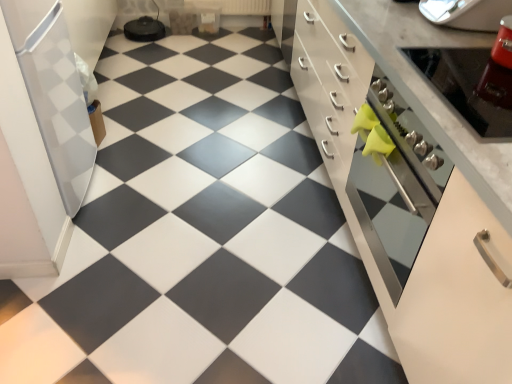
What do you see at coordinates (470, 86) in the screenshot? I see `metallic silver oven at right, the 2th appliance viewed from the right` at bounding box center [470, 86].

Where is `white glossy refrigerator at left, marked as the 1th appliance in a left-to-right arrangement`? The height and width of the screenshot is (384, 512). white glossy refrigerator at left, marked as the 1th appliance in a left-to-right arrangement is located at coordinates point(54,93).

Measure the distance between white glossy cabinet at center and camera.

The depth of white glossy cabinet at center is 32.90 inches.

Locate an element on the screen. matte black tile at center is located at coordinates (201, 237).

How much space does metallic silver toaster at upper right, which appears as the third appliance when viewed from the left, occupy horizontally?

metallic silver toaster at upper right, which appears as the third appliance when viewed from the left, is 33.33 centimeters in width.

Where is `metallic silver oven at right, the 2th appliance viewed from the right`? This screenshot has width=512, height=384. metallic silver oven at right, the 2th appliance viewed from the right is located at coordinates (470, 86).

In terms of height, does matte black tile at center look taller or shorter compared to white glossy cabinet at center?

Considering their sizes, matte black tile at center has less height than white glossy cabinet at center.

From the image's perspective, is matte black tile at center located beneath white glossy cabinet at center?

No, from the image's perspective, matte black tile at center is not beneath white glossy cabinet at center.

Find the location of a particular element. This screenshot has width=512, height=384. cabinetry located above the matte black tile at center (from a real-world perspective) is located at coordinates (414, 182).

Based on the photo, which of these two, white glossy cabinet at center or metallic silver toaster at upper right, the 1th appliance viewed from the right, is bigger?

white glossy cabinet at center is bigger.

Measure the distance between white glossy cabinet at center and metallic silver toaster at upper right, which appears as the third appliance when viewed from the left.

white glossy cabinet at center is 18.57 inches from metallic silver toaster at upper right, which appears as the third appliance when viewed from the left.

Does point (403, 91) come closer to viewer compared to point (450, 20)?

Yes, point (403, 91) is in front of point (450, 20).

From the image's perspective, is white glossy cabinet at center on top of metallic silver toaster at upper right, the 1th appliance viewed from the right?

No.

Is metallic silver oven at right, which is counted as the 2th appliance, starting from the left, positioned behind white glossy cabinet at center?

Yes, it is.

This screenshot has height=384, width=512. In order to click on appliance that is the 1st object to the right of the white glossy cabinet at center, starting at the anchor in this screenshot , I will do `click(470, 86)`.

Is metallic silver oven at right, which is counted as the 2th appliance, starting from the left, oriented towards white glossy cabinet at center?

Yes, metallic silver oven at right, which is counted as the 2th appliance, starting from the left, is aimed at white glossy cabinet at center.

Is metallic silver oven at right, the 2th appliance viewed from the right, smaller than white glossy cabinet at center?

Yes.

How many degrees apart are the facing directions of metallic silver oven at right and metallic silver toaster at upper right, the 1th appliance viewed from the right?

The facing directions of metallic silver oven at right and metallic silver toaster at upper right, the 1th appliance viewed from the right, are 0.000274 degrees apart.

Considering the relative sizes of metallic silver oven at right and metallic silver toaster at upper right, the 1th appliance viewed from the right, in the image provided, is metallic silver oven at right smaller than metallic silver toaster at upper right, the 1th appliance viewed from the right,?

Incorrect, metallic silver oven at right is not smaller in size than metallic silver toaster at upper right, the 1th appliance viewed from the right.

Which is behind, metallic silver oven at right or metallic silver toaster at upper right, the 1th appliance viewed from the right?

metallic silver toaster at upper right, the 1th appliance viewed from the right, is further away from the camera.

Is metallic silver oven at right turned away from metallic silver toaster at upper right, the 1th appliance viewed from the right?

metallic silver oven at right does not have its back to metallic silver toaster at upper right, the 1th appliance viewed from the right.

From a real-world perspective, relative to metallic silver oven at right, is matte black tile at center vertically above or below?

In terms of real-world spatial position, matte black tile at center is below metallic silver oven at right.

Between matte black tile at center and metallic silver oven at right, which one has less height?

matte black tile at center is shorter.

Is matte black tile at center looking in the opposite direction of metallic silver oven at right?

That's not correct — matte black tile at center is not looking away from metallic silver oven at right.

Is matte black tile at center completely or partially outside of metallic silver oven at right?

Yes, matte black tile at center is outside of metallic silver oven at right.

Is white glossy cabinet at center to the right of matte black tile at center from the viewer's perspective?

Yes, white glossy cabinet at center is to the right of matte black tile at center.

From a real-world perspective, which is physically below, white glossy cabinet at center or matte black tile at center?

matte black tile at center.

Is white glossy cabinet at center outside of matte black tile at center?

Absolutely, white glossy cabinet at center is external to matte black tile at center.

From the image's perspective, between white glossy cabinet at center and matte black tile at center, which one is located above?

matte black tile at center is shown above in the image.

Is metallic silver oven at right, which is counted as the 2th appliance, starting from the left, to the left or to the right of metallic silver oven at right in the image?

In the image, metallic silver oven at right, which is counted as the 2th appliance, starting from the left, appears on the left side of metallic silver oven at right.

Does point (476, 73) lie behind point (361, 196)?

No, (476, 73) is in front of (361, 196).

From the image's perspective, which one is positioned higher, metallic silver oven at right, which is counted as the 2th appliance, starting from the left, or metallic silver oven at right?

From the image's view, metallic silver oven at right, which is counted as the 2th appliance, starting from the left, is above.

Considering the sizes of metallic silver oven at right, which is counted as the 2th appliance, starting from the left, and metallic silver oven at right in the image, is metallic silver oven at right, which is counted as the 2th appliance, starting from the left, bigger or smaller than metallic silver oven at right?

metallic silver oven at right, which is counted as the 2th appliance, starting from the left, is smaller than metallic silver oven at right.

You are a GUI agent. You are given a task and a screenshot of the screen. Output one action in this format:
    pyautogui.click(x=<x>, y=<y>)
    Task: Click on the tile that appears below the white glossy cabinet at center (from a real-world perspective)
    The image size is (512, 384).
    Given the screenshot: What is the action you would take?
    pyautogui.click(x=201, y=237)

Locate an element on the screen. This screenshot has width=512, height=384. the 3rd appliance positioned above the white glossy cabinet at center (from the image's perspective) is located at coordinates (466, 13).

From the image, which object appears to be farther from metallic silver oven at right, metallic silver oven at right, the 2th appliance viewed from the right, or metallic silver toaster at upper right, the 1th appliance viewed from the right?

metallic silver toaster at upper right, the 1th appliance viewed from the right.

From the picture: When comparing their distances from metallic silver toaster at upper right, the 1th appliance viewed from the right, does matte black tile at center or metallic silver oven at right, the 2th appliance viewed from the right, seem closer?

metallic silver oven at right, the 2th appliance viewed from the right.

Which object lies nearer to the anchor point metallic silver toaster at upper right, which appears as the third appliance when viewed from the left, white glossy cabinet at center or metallic silver oven at right, which is counted as the 2th appliance, starting from the left?

The object closer to metallic silver toaster at upper right, which appears as the third appliance when viewed from the left, is metallic silver oven at right, which is counted as the 2th appliance, starting from the left.

From the image, which object appears to be farther from metallic silver oven at right, the 2th appliance viewed from the right, white glossy refrigerator at left, positioned as the 3th appliance in right-to-left order, or matte black tile at center?

The object further to metallic silver oven at right, the 2th appliance viewed from the right, is white glossy refrigerator at left, positioned as the 3th appliance in right-to-left order.

Which object lies nearer to the anchor point white glossy refrigerator at left, positioned as the 3th appliance in right-to-left order, white glossy cabinet at center or metallic silver toaster at upper right, the 1th appliance viewed from the right?

white glossy cabinet at center.

From the image, which object appears to be nearer to white glossy refrigerator at left, marked as the 1th appliance in a left-to-right arrangement, metallic silver oven at right or metallic silver toaster at upper right, which appears as the third appliance when viewed from the left?

metallic silver oven at right is closer to white glossy refrigerator at left, marked as the 1th appliance in a left-to-right arrangement.

Looking at the image, which one is located further to white glossy cabinet at center, metallic silver oven at right or matte black tile at center?

The object further to white glossy cabinet at center is matte black tile at center.

From the image, which object appears to be nearer to metallic silver oven at right, matte black tile at center or metallic silver oven at right, the 2th appliance viewed from the right?

Based on the image, metallic silver oven at right, the 2th appliance viewed from the right, appears to be nearer to metallic silver oven at right.

Locate an element on the screen. The image size is (512, 384). oven located between white glossy cabinet at center and metallic silver toaster at upper right, the 1th appliance viewed from the right, in the depth direction is located at coordinates (x=394, y=182).

Locate an element on the screen. tile located between white glossy refrigerator at left, positioned as the 3th appliance in right-to-left order, and white glossy cabinet at center in the left-right direction is located at coordinates (201, 237).

Locate an element on the screen. Image resolution: width=512 pixels, height=384 pixels. cabinetry located between matte black tile at center and metallic silver oven at right, which is counted as the 2th appliance, starting from the left, in the left-right direction is located at coordinates (414, 182).

In order to click on tile located between white glossy refrigerator at left, marked as the 1th appliance in a left-to-right arrangement, and metallic silver toaster at upper right, the 1th appliance viewed from the right, in the left-right direction in this screenshot , I will do `click(201, 237)`.